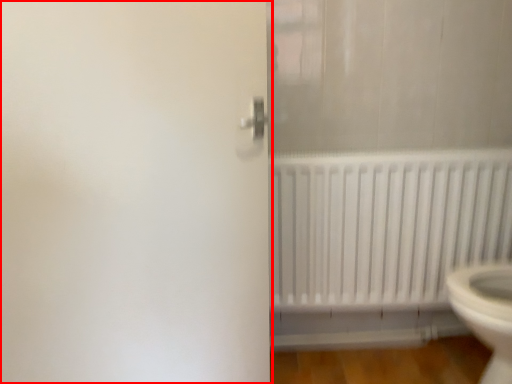
Question: Observing the image, what is the correct spatial positioning of screen door (annotated by the red box) in reference to radiator?

Choices:
 (A) left
 (B) right

Answer: (A)